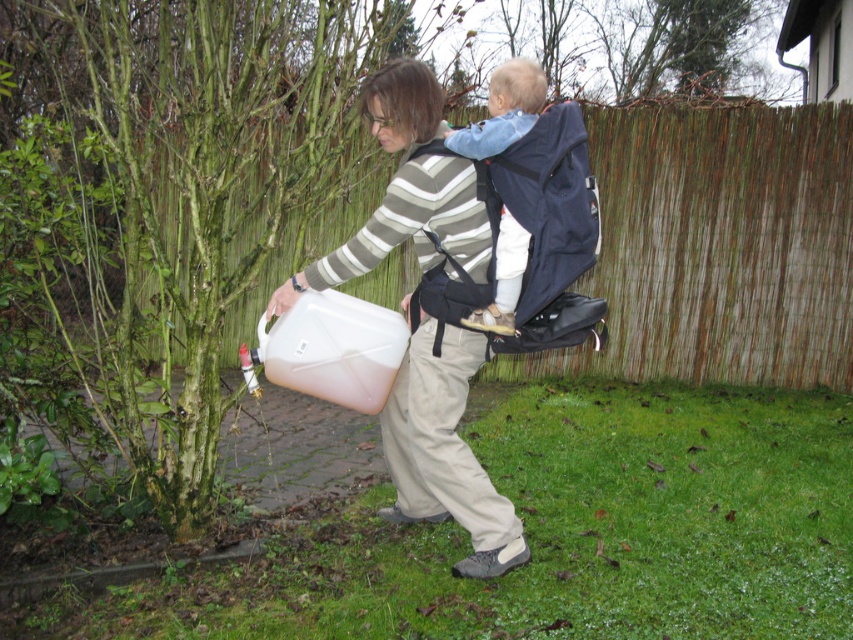
Who is higher up, brown woven fence at upper center or matte plastic container at center?

brown woven fence at upper center is higher up.

Does brown woven fence at upper center have a greater width compared to matte plastic container at center?

Yes, brown woven fence at upper center is wider than matte plastic container at center.

Between point (694, 129) and point (379, 132), which one is positioned in front?

Point (379, 132) is more forward.

Locate an element on the screen. This screenshot has height=640, width=853. brown woven fence at upper center is located at coordinates (720, 248).

Does brown woven fence at upper center have a greater height compared to blue fabric carrier at center?

Correct, brown woven fence at upper center is much taller as blue fabric carrier at center.

Which is in front, point (305, 230) or point (479, 140)?

Positioned in front is point (479, 140).

What do you see at coordinates (720, 248) in the screenshot?
I see `brown woven fence at upper center` at bounding box center [720, 248].

Locate an element on the screen. The width and height of the screenshot is (853, 640). brown woven fence at upper center is located at coordinates (720, 248).

Is point (491, 512) closer to viewer compared to point (485, 128)?

No, (491, 512) is further to viewer.

Does matte plastic container at center have a greater width compared to blue fabric carrier at center?

Yes, matte plastic container at center is wider than blue fabric carrier at center.

What do you see at coordinates (407, 189) in the screenshot? I see `matte plastic container at center` at bounding box center [407, 189].

Locate an element on the screen. This screenshot has height=640, width=853. matte plastic container at center is located at coordinates (407, 189).